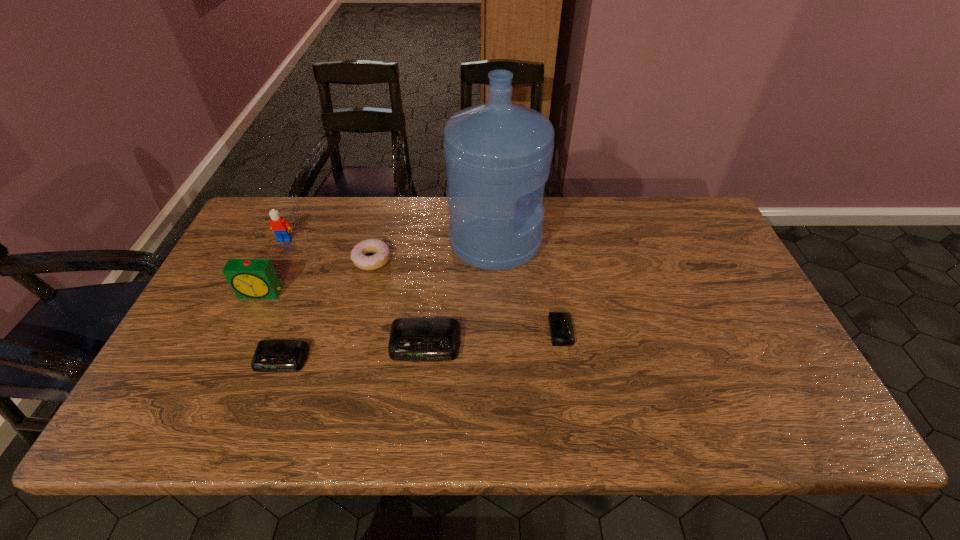
Where is `object present at the far left corner`? The image size is (960, 540). object present at the far left corner is located at coordinates (281, 227).

I want to click on vacant area at the far edge of the desktop, so click(421, 218).

In the image, there is a desktop. In order to click on vacant space at the near edge in this screenshot , I will do `click(450, 370)`.

Locate an element on the screen. Image resolution: width=960 pixels, height=540 pixels. vacant point at the right edge is located at coordinates (725, 300).

The height and width of the screenshot is (540, 960). What are the coordinates of `vacant space at the far left corner` in the screenshot? It's located at (281, 206).

Where is `free region at the near left corner`? The width and height of the screenshot is (960, 540). free region at the near left corner is located at coordinates (227, 388).

In the image, there is a desktop. Where is `vacant space at the far right corner`? The image size is (960, 540). vacant space at the far right corner is located at coordinates (682, 221).

I want to click on vacant area that lies between the fourth object from left to right and the shortest object, so click(x=467, y=295).

Where is `blank region between the Lego and the water jug`? This screenshot has width=960, height=540. blank region between the Lego and the water jug is located at coordinates (390, 240).

Find the location of a particular element. This screenshot has width=960, height=540. vacant space that is in between the third shortest alarm clock and the Lego is located at coordinates (355, 292).